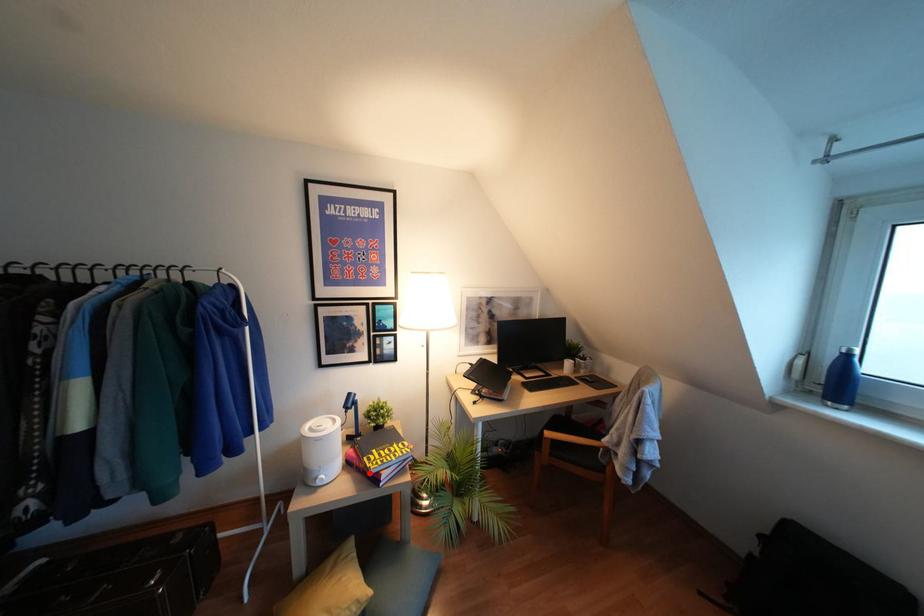
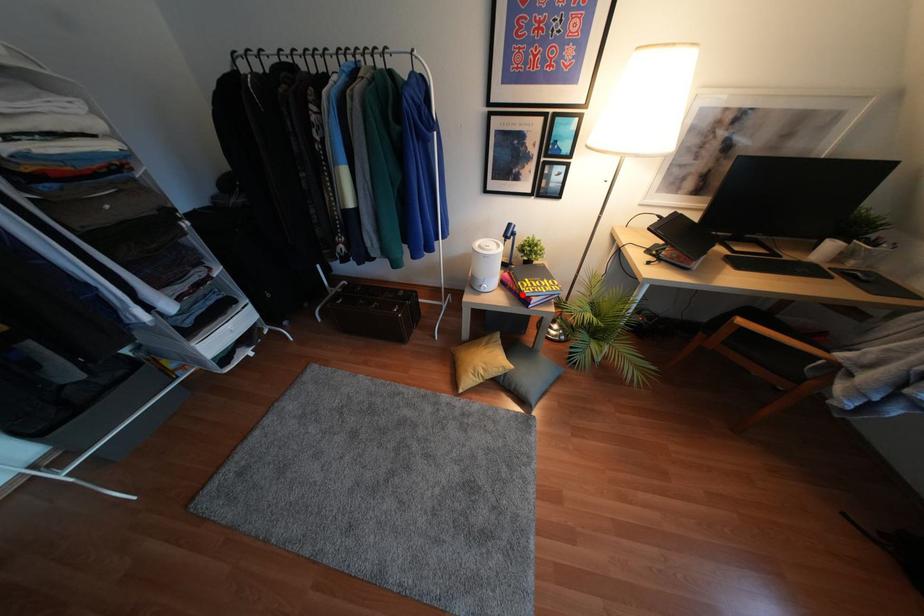
I am providing you with two images of the same scene from different viewpoints. A red point is marked on the first image and another point is marked on the second image. Is the red point in image1 aligned with the point shown in image2?

Yes